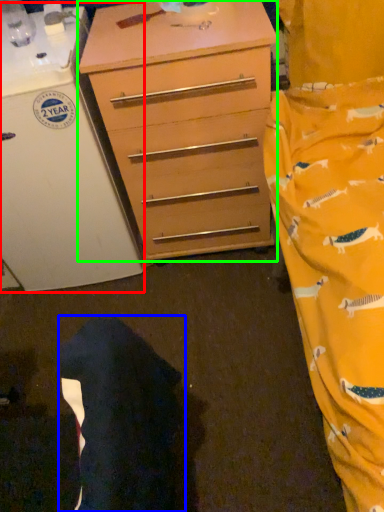
Question: Based on their relative distances, which object is nearer to appliance (highlighted by a red box)? Choose from robe (highlighted by a blue box) and chest of drawers (highlighted by a green box).

Choices:
 (A) robe
 (B) chest of drawers

Answer: (B)